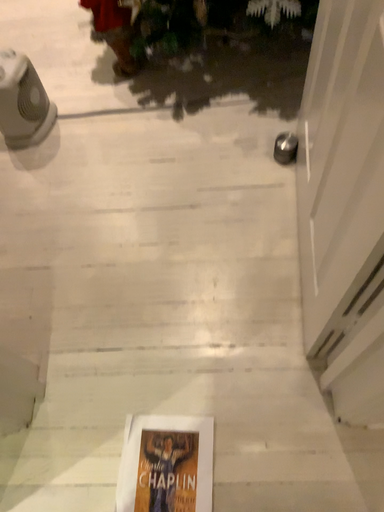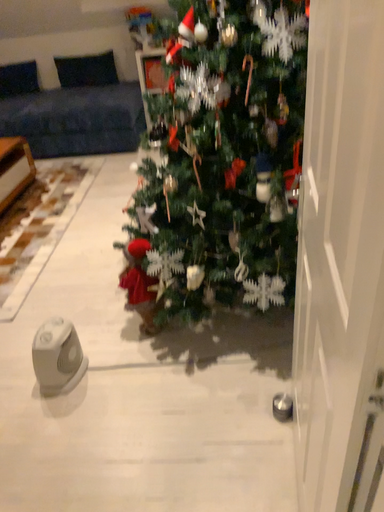
Question: How did the camera likely rotate when shooting the video?

Choices:
 (A) rotated upward
 (B) rotated downward

Answer: (A)